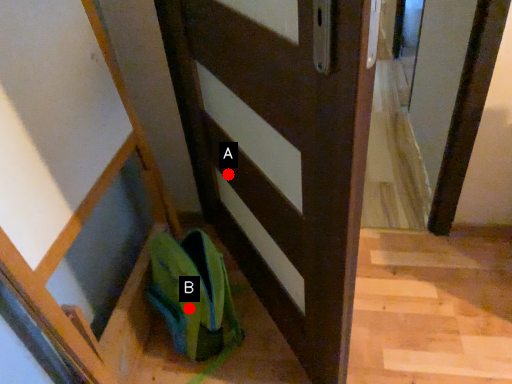
Question: Two points are circled on the image, labeled by A and B beside each circle. Which point is farther from the camera taking this photo?

Choices:
 (A) A is further
 (B) B is further

Answer: (A)